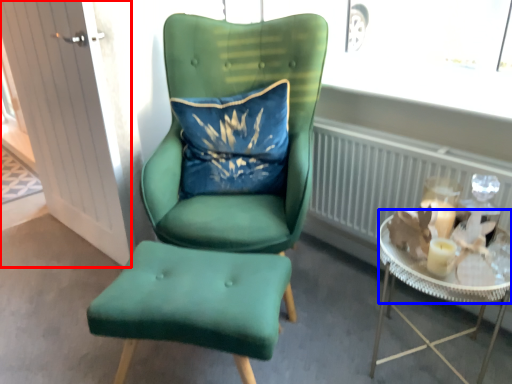
Question: Which object appears farthest to the camera in this image, glass door (highlighted by a red box) or glass table (highlighted by a blue box)?

Choices:
 (A) glass door
 (B) glass table

Answer: (A)